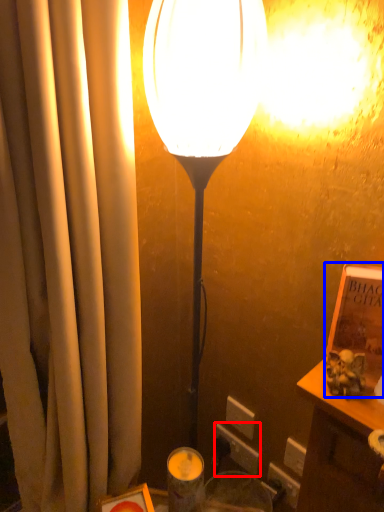
Question: Among these objects, which one is farthest to the camera, electric outlet (highlighted by a red box) or book (highlighted by a blue box)?

Choices:
 (A) electric outlet
 (B) book

Answer: (A)